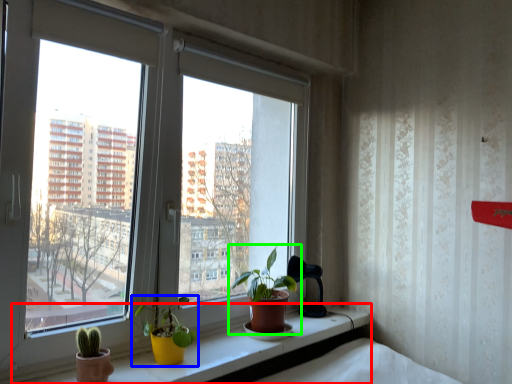
Question: Which object is positioned farthest from window sill (highlighted by a red box)? Select from houseplant (highlighted by a blue box) and houseplant (highlighted by a green box).

Choices:
 (A) houseplant
 (B) houseplant

Answer: (B)